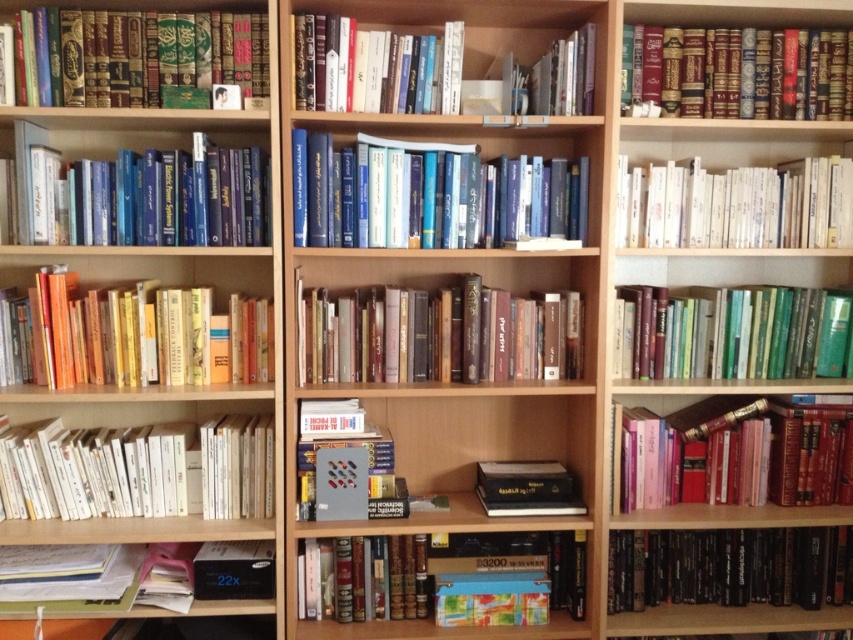
Between hardcover books at center and metallic gray book at center, which one has more height?

metallic gray book at center is taller.

Does hardcover books at center have a larger size compared to metallic gray book at center?

Correct, hardcover books at center is larger in size than metallic gray book at center.

Is point (524, 371) positioned before point (323, 413)?

That is False.

Image resolution: width=853 pixels, height=640 pixels. I want to click on hardcover books at center, so click(432, 336).

Is point (105, 161) more distant than point (664, 216)?

Yes, point (105, 161) is behind point (664, 216).

Who is taller, blue hardcover books at left or white paperbacks at center?

blue hardcover books at left

Where is `blue hardcover books at left`? The width and height of the screenshot is (853, 640). blue hardcover books at left is located at coordinates (140, 196).

Which is more to the left, wooden bookshelf at left or blue hardcover books at center?

From the viewer's perspective, wooden bookshelf at left appears more on the left side.

Locate an element on the screen. The width and height of the screenshot is (853, 640). wooden bookshelf at left is located at coordinates (160, 387).